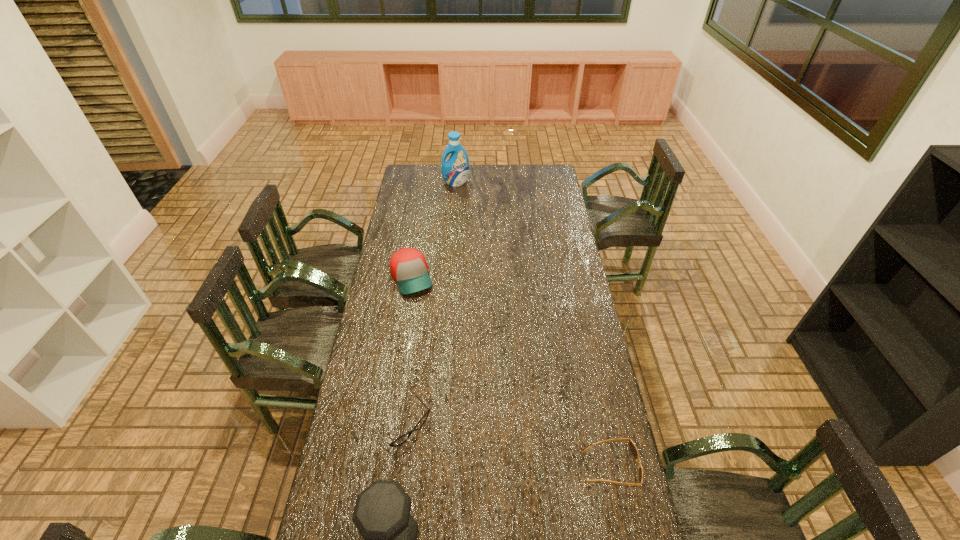
I want to click on the rightmost object, so click(x=633, y=449).

Where is `the shortest object`? the shortest object is located at coordinates (633, 449).

Identify the location of baseball cap. Image resolution: width=960 pixels, height=540 pixels. (408, 266).

The width and height of the screenshot is (960, 540). I want to click on the third shortest object, so (x=408, y=266).

At what (x,y) coordinates should I click in order to perform the action: click on spectacles. Please return your answer as a coordinate pair (x, y). This screenshot has height=540, width=960. Looking at the image, I should click on (403, 438).

Locate an element on the screen. The image size is (960, 540). the tallest object is located at coordinates (455, 171).

The image size is (960, 540). In order to click on detergent in this screenshot , I will do `click(455, 171)`.

In order to click on vacant space located 0.240m at the brim of the second farthest object in this screenshot , I will do `click(435, 337)`.

You are a GUI agent. You are given a task and a screenshot of the screen. Output one action in this format:
    pyautogui.click(x=<x>, y=<y>)
    Task: Click on the free space located at the brim of the second farthest object
    The width and height of the screenshot is (960, 540).
    Given the screenshot: What is the action you would take?
    pyautogui.click(x=440, y=348)

In order to click on free space located 0.110m at the brim of the second farthest object in this screenshot , I will do `click(424, 314)`.